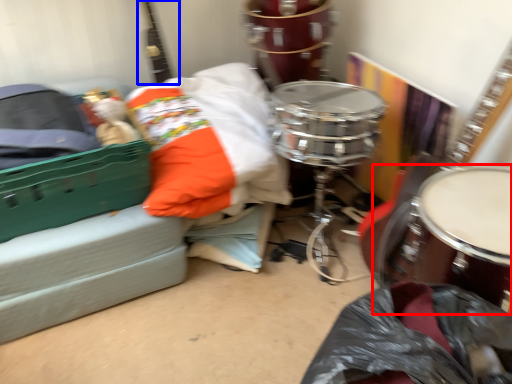
Question: Which of the following is the closest to the observer, drum (highlighted by a red box) or guitar (highlighted by a blue box)?

Choices:
 (A) drum
 (B) guitar

Answer: (A)